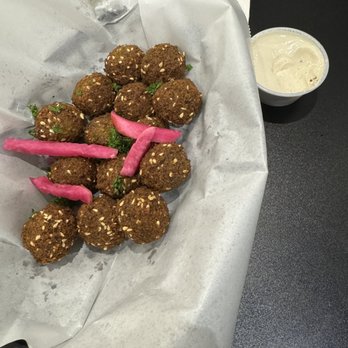
You are a GUI agent. You are given a task and a screenshot of the screen. Output one action in this format:
    pyautogui.click(x=<x>, y=<y>)
    Task: Click on the table
    Image resolution: width=348 pixels, height=348 pixels.
    Given the screenshot: What is the action you would take?
    pyautogui.click(x=311, y=257)